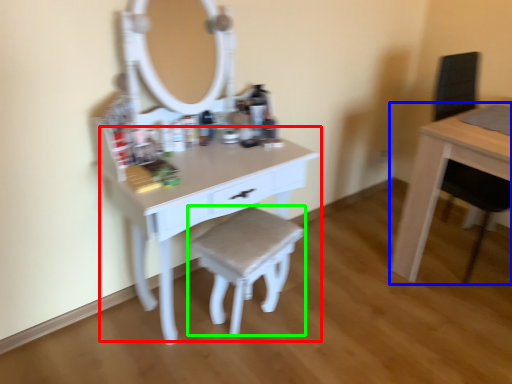
Question: Considering the real-world distances, which object is farthest from table (highlighted by a red box)? table (highlighted by a blue box) or stool (highlighted by a green box)?

Choices:
 (A) table
 (B) stool

Answer: (A)